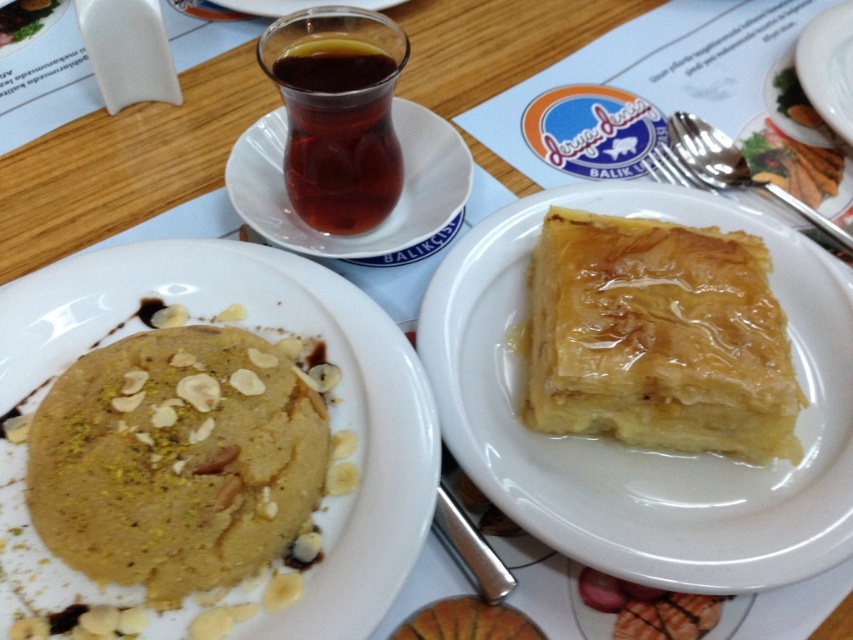
Question: Is golden flaky pastry at right thinner than transparent glass cup at upper center?

Choices:
 (A) no
 (B) yes

Answer: (B)

Question: Which point is closer to the camera taking this photo?

Choices:
 (A) (241, 179)
 (B) (695, 177)

Answer: (A)

Question: Is golden flaky pastry at right wider than white glossy plate at upper center?

Choices:
 (A) no
 (B) yes

Answer: (B)

Question: Does silver metallic fork at upper right have a lesser width compared to white glossy plate at upper center?

Choices:
 (A) no
 (B) yes

Answer: (A)

Question: Which object is closer to the camera taking this photo?

Choices:
 (A) transparent glass cup at upper center
 (B) golden flaky pastry at right

Answer: (B)

Question: Which point is farther from the camera taking this photo?

Choices:
 (A) (355, 324)
 (B) (840, 376)

Answer: (B)